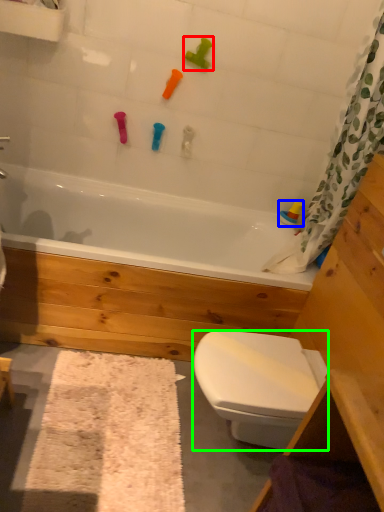
Question: Which object is the closest to the toy (highlighted by a red box)? Choose among these: toy (highlighted by a blue box) or bidet (highlighted by a green box).

Choices:
 (A) toy
 (B) bidet

Answer: (A)